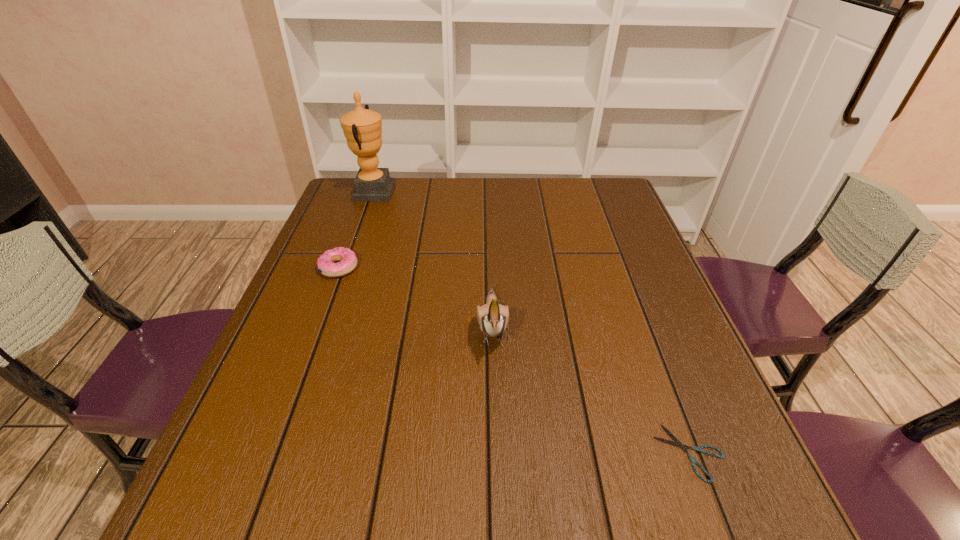
Locate an element on the screen. free region located 0.240m on the right of the doughnut is located at coordinates pos(451,268).

Find the location of `vacant space located 0.320m on the left of the shears`. vacant space located 0.320m on the left of the shears is located at coordinates (472, 453).

This screenshot has height=540, width=960. Find the location of `object that is positioned at the far edge`. object that is positioned at the far edge is located at coordinates (362, 128).

Identify the location of object present at the near edge. The width and height of the screenshot is (960, 540). (677, 443).

Find the location of `award situated at the left edge`. award situated at the left edge is located at coordinates (362, 128).

Find the location of a particular element. doughnut that is at the left edge is located at coordinates (347, 259).

Where is `object that is at the right edge`? Image resolution: width=960 pixels, height=540 pixels. object that is at the right edge is located at coordinates (677, 443).

At what (x,y) coordinates should I click in order to perform the action: click on object present at the far left corner. Please return your answer as a coordinate pair (x, y). Looking at the image, I should click on (362, 128).

Where is `object located in the near right corner section of the desktop`? object located in the near right corner section of the desktop is located at coordinates (677, 443).

At what (x,y) coordinates should I click in order to perform the action: click on vacant space at the far edge. Please return your answer as a coordinate pair (x, y). The image size is (960, 540). Looking at the image, I should click on (487, 208).